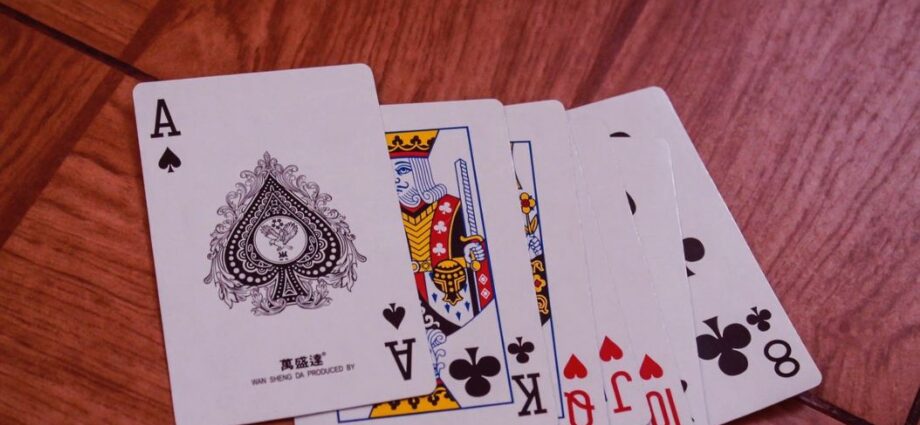
You are a GUI agent. You are given a task and a screenshot of the screen. Output one action in this format:
    pyautogui.click(x=<x>, y=<y>)
    Task: Click on the table
    
    Given the screenshot: What is the action you would take?
    pyautogui.click(x=101, y=185), pyautogui.click(x=527, y=39), pyautogui.click(x=762, y=115)